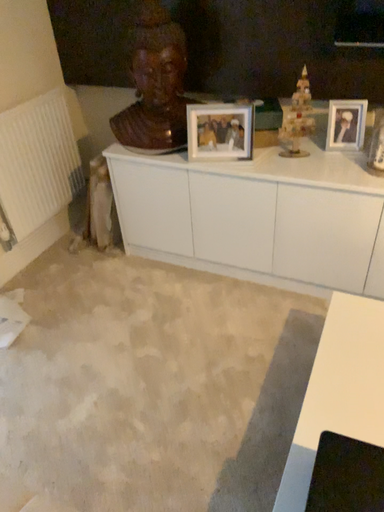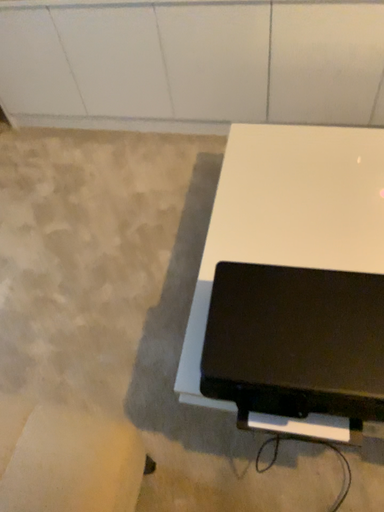
Question: How did the camera likely rotate when shooting the video?

Choices:
 (A) rotated downward
 (B) rotated upward

Answer: (A)